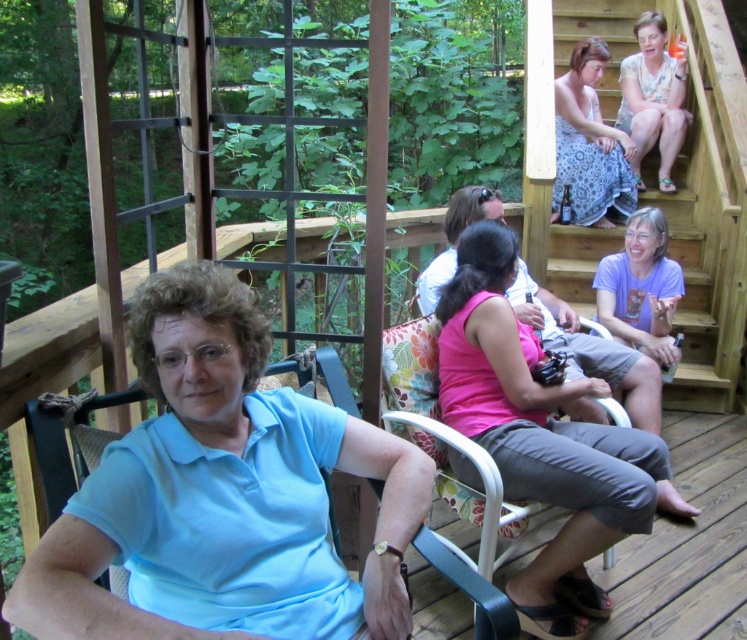
Can you confirm if purple cotton shirt at lower right is positioned to the left of floral fabric chair at center?

In fact, purple cotton shirt at lower right is to the right of floral fabric chair at center.

Is the position of purple cotton shirt at lower right more distant than that of floral fabric chair at center?

Yes, purple cotton shirt at lower right is behind floral fabric chair at center.

Identify the location of purple cotton shirt at lower right. (639, 289).

You are a GUI agent. You are given a task and a screenshot of the screen. Output one action in this format:
    pyautogui.click(x=<x>, y=<y>)
    Task: Click on the purple cotton shirt at lower right
    
    Given the screenshot: What is the action you would take?
    pyautogui.click(x=639, y=289)

Is patterned fabric dress at upper right closer to the viewer compared to purple cotton shirt at lower right?

That is False.

Is point (607, 204) farther from camera compared to point (666, 284)?

Yes, it is.

Where is `patterned fabric dress at upper right`? The image size is (747, 640). patterned fabric dress at upper right is located at coordinates (589, 145).

Does pink fabric tank top at center have a greater width compared to purple cotton shirt at lower right?

Indeed, pink fabric tank top at center has a greater width compared to purple cotton shirt at lower right.

Does point (492, 404) come closer to viewer compared to point (657, 275)?

Yes, point (492, 404) is closer to viewer.

Image resolution: width=747 pixels, height=640 pixels. I want to click on pink fabric tank top at center, so click(x=539, y=436).